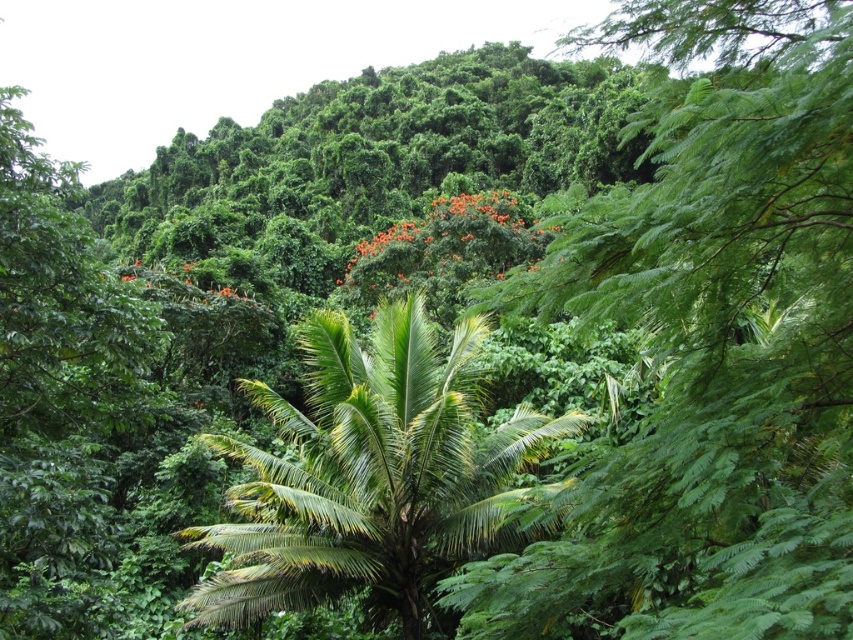
In the tropical forest scene, you see a green leafy palm at center and an orange bloom at center. Which object is positioned to the left?

The green leafy palm at center is to the left of the orange bloom at center.

You are standing in the tropical forest scene. You see the green leafy palm at center. What are its coordinates in the image?

The green leafy palm at center is located at coordinates point (364, 474).

In the scene shown: You are a botanist studying the plants in this tropical forest. You notice the green leafy palm at center and the orange bloom at center. Which of these two plants is smaller in size?

The green leafy palm at center is smaller in size compared to the orange bloom at center.